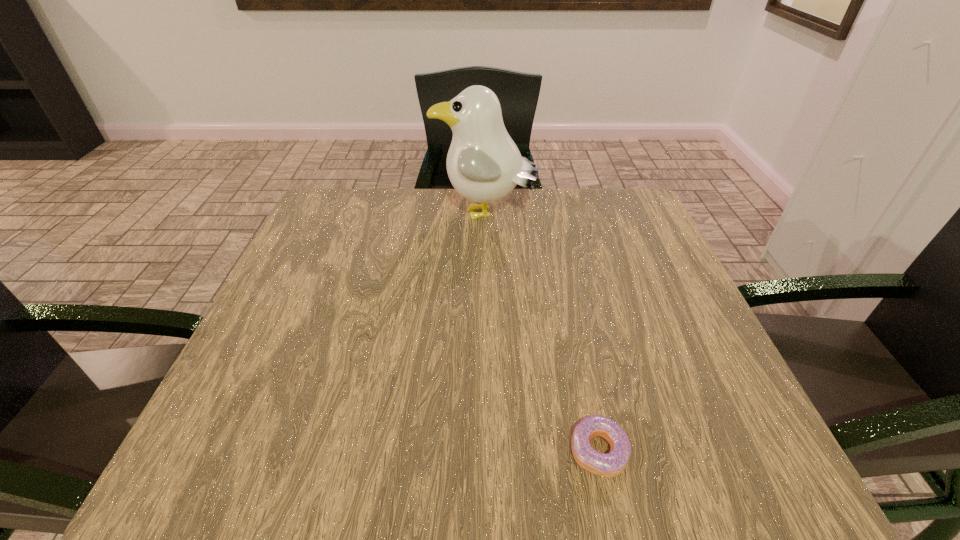
Locate an element on the screen. The image size is (960, 540). free space at the far edge of the desktop is located at coordinates (530, 194).

Where is `free space at the near edge of the desktop`? This screenshot has width=960, height=540. free space at the near edge of the desktop is located at coordinates (400, 451).

Locate an element on the screen. The width and height of the screenshot is (960, 540). vacant area at the left edge is located at coordinates (230, 368).

The width and height of the screenshot is (960, 540). In the image, there is a desktop. What are the coordinates of `free space at the right edge` in the screenshot? It's located at (656, 339).

The image size is (960, 540). Find the location of `vacant space at the far left corner`. vacant space at the far left corner is located at coordinates (329, 207).

Where is `vacant space at the far right corner of the desktop`? vacant space at the far right corner of the desktop is located at coordinates (597, 195).

In order to click on vacant space that satisfies the following two spatial constraints: 1. on the beak of the nearer object; 2. on the right side of the taller object in this screenshot , I will do `click(489, 451)`.

Locate an element on the screen. Image resolution: width=960 pixels, height=540 pixels. vacant space that satisfies the following two spatial constraints: 1. on the back side of the shorter object; 2. on the beak of the gull is located at coordinates (549, 216).

Where is `vacant region that satisfies the following two spatial constraints: 1. on the back side of the doughnut; 2. on the beak of the gull`? The height and width of the screenshot is (540, 960). vacant region that satisfies the following two spatial constraints: 1. on the back side of the doughnut; 2. on the beak of the gull is located at coordinates (549, 216).

Locate an element on the screen. The width and height of the screenshot is (960, 540). vacant area that satisfies the following two spatial constraints: 1. on the back side of the shorter object; 2. on the beak of the taller object is located at coordinates (549, 216).